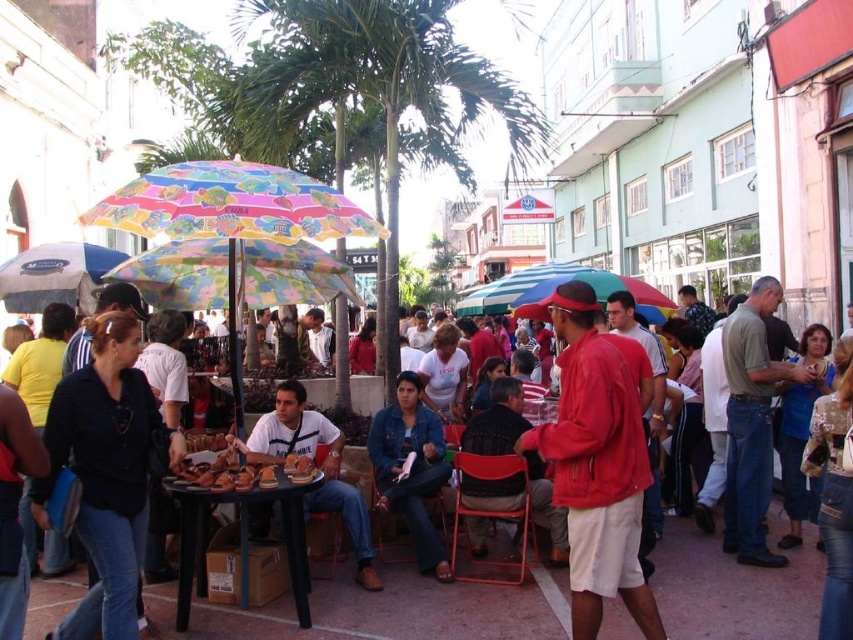
Between point (26, 312) and point (653, 317), which one is positioned in front?

Point (26, 312)

Can you confirm if matte blue umbrella at left is positioned above multicolored fabric umbrella at center?

Incorrect, matte blue umbrella at left is not positioned above multicolored fabric umbrella at center.

Where is `matte blue umbrella at left`? The width and height of the screenshot is (853, 640). matte blue umbrella at left is located at coordinates (55, 275).

At what (x,y) coordinates should I click in order to perform the action: click on green leafy palm tree at center. Please return your answer as a coordinate pair (x, y). The image size is (853, 640). Looking at the image, I should click on (380, 92).

Is green leafy palm tree at center taller than denim jacket at center?

→ Yes, green leafy palm tree at center is taller than denim jacket at center.

I want to click on green leafy palm tree at center, so click(380, 92).

Between dark blue denim jeans at center and multicolored fabric umbrella at center, which one is positioned lower?

dark blue denim jeans at center is lower down.

This screenshot has height=640, width=853. I want to click on dark blue denim jeans at center, so click(x=106, y=472).

Find the location of a particular element. This screenshot has height=640, width=853. dark blue denim jeans at center is located at coordinates (106, 472).